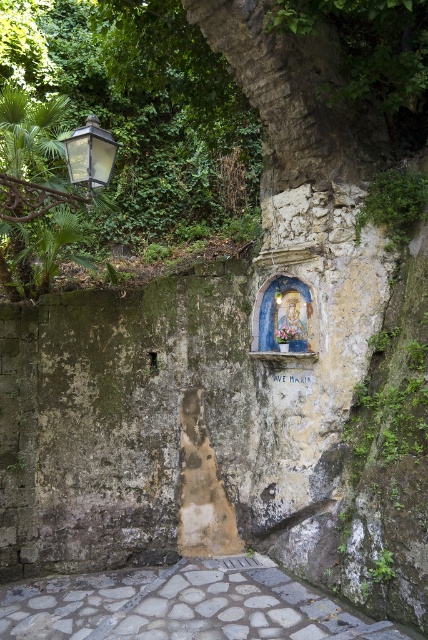
Is gray stone path at center below green leafy plant at upper right?

Yes, gray stone path at center is below green leafy plant at upper right.

Between gray stone path at center and green leafy plant at upper right, which one has more height?

With more height is green leafy plant at upper right.

Identify the location of gray stone path at center. (184, 605).

Identify the location of gray stone path at center. (184, 605).

Does green leafy plant at upper right have a lesser width compared to matte black lantern at upper left?

No, green leafy plant at upper right is not thinner than matte black lantern at upper left.

Which is behind, point (369, 196) or point (92, 160)?

The point (369, 196) is more distant.

Between point (362, 221) and point (104, 145), which one is positioned behind?

The point (362, 221) is more distant.

Locate an element on the screen. This screenshot has width=428, height=640. green leafy plant at upper right is located at coordinates 394,204.

Is gray stone path at center in front of matte black lantern at upper left?

No, it is not.

Is point (315, 616) behind point (88, 193)?

No.

Locate an element on the screen. This screenshot has width=428, height=640. gray stone path at center is located at coordinates (184, 605).